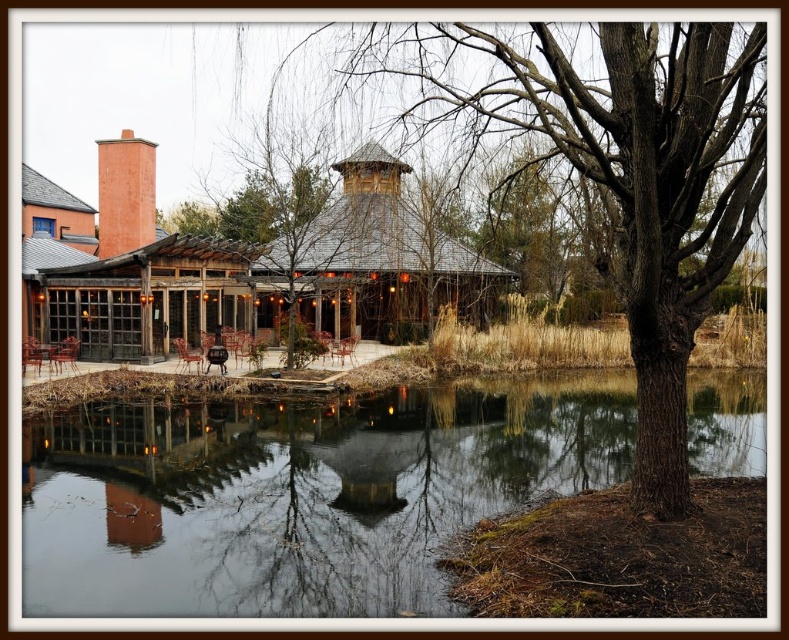
Is transparent water at center wider than rustic brick chimney at upper left?

Correct, the width of transparent water at center exceeds that of rustic brick chimney at upper left.

Who is positioned more to the left, transparent water at center or rustic brick chimney at upper left?

rustic brick chimney at upper left

Measure the distance between point (144, 582) and camera.

Point (144, 582) and camera are 24.20 feet apart.

I want to click on transparent water at center, so click(298, 493).

Can you confirm if brown rough bark tree at center is smaller than rustic brick chimney at upper left?

Actually, brown rough bark tree at center might be larger than rustic brick chimney at upper left.

Is brown rough bark tree at center to the left of rustic brick chimney at upper left from the viewer's perspective?

In fact, brown rough bark tree at center is to the right of rustic brick chimney at upper left.

Identify the location of brown rough bark tree at center. (629, 179).

Who is higher up, transparent water at center or brown rough bark tree at center?

brown rough bark tree at center is above.

Does point (324, 445) come farther from viewer compared to point (735, 234)?

Yes, point (324, 445) is behind point (735, 234).

Does point (391, 554) come in front of point (645, 445)?

No, it is not.

This screenshot has height=640, width=789. I want to click on transparent water at center, so click(298, 493).